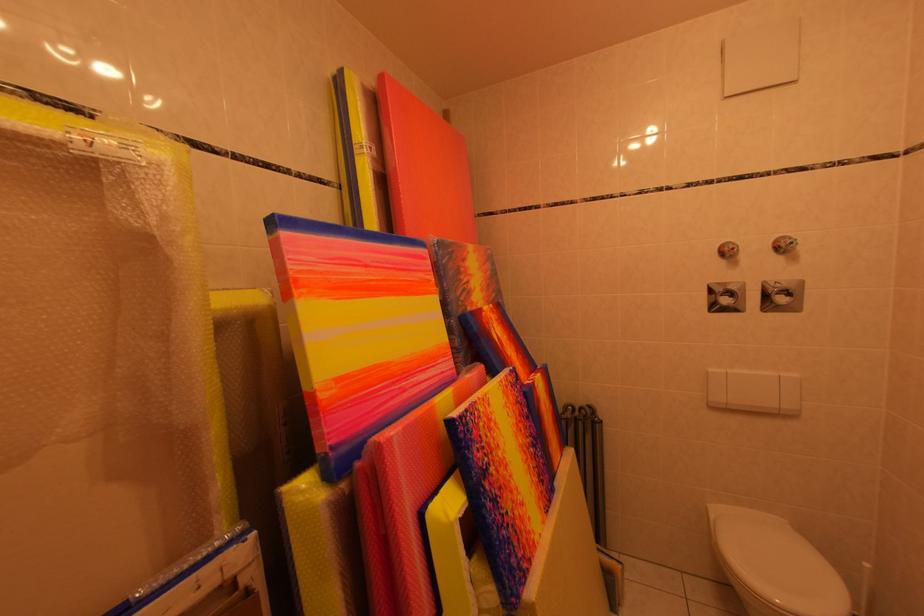
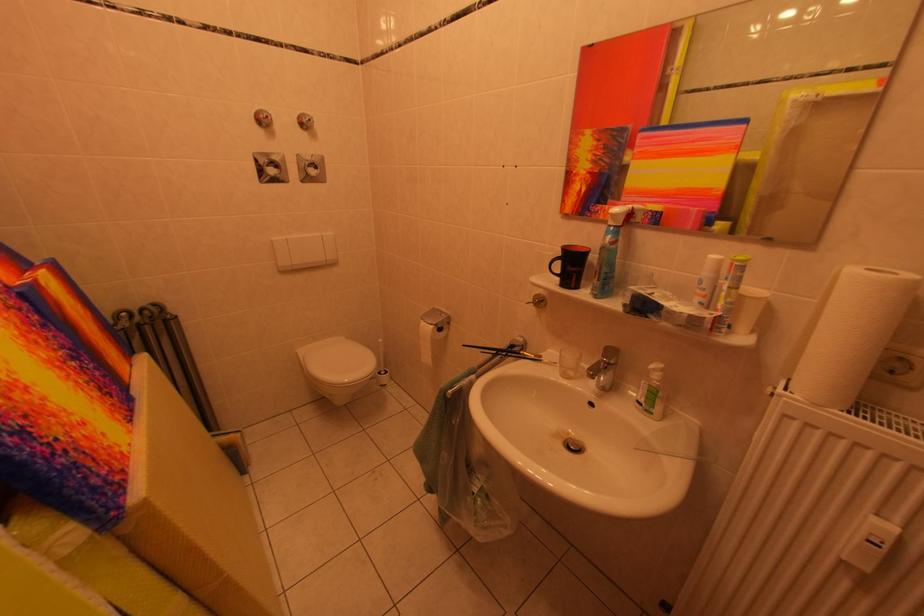
Where in the second image is the point corresponding to (x=725, y=515) from the first image?

(311, 355)